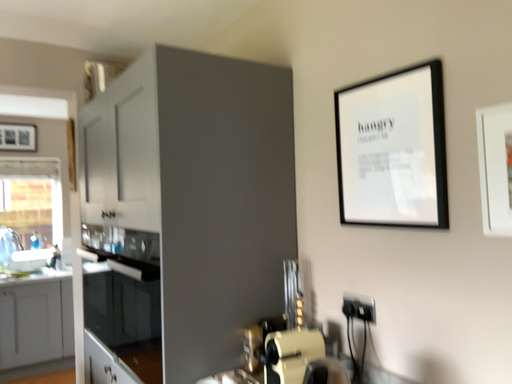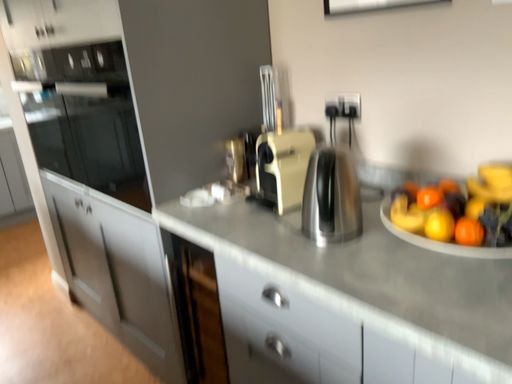
Question: Which way did the camera rotate in the video?

Choices:
 (A) rotated downward
 (B) rotated upward

Answer: (A)